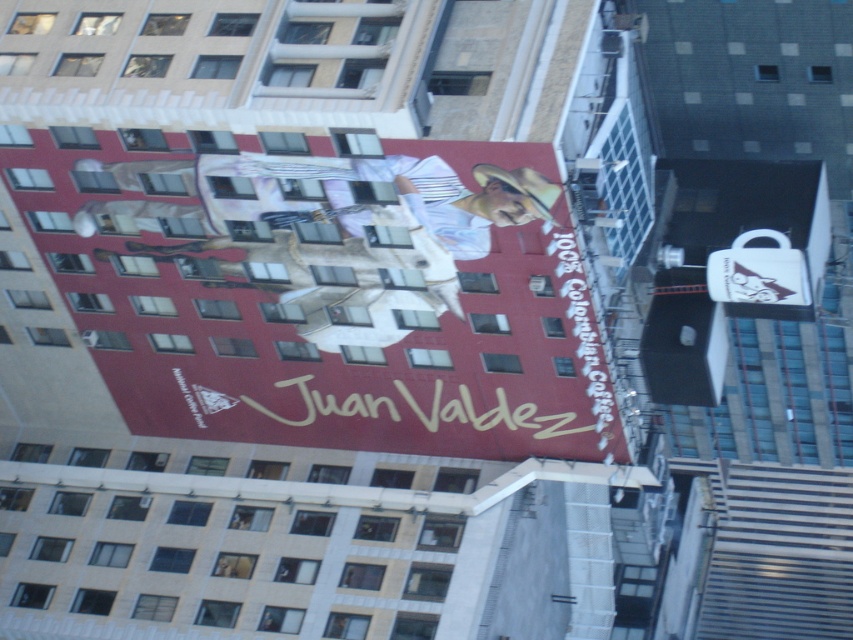
You are an advertiser checking the layout of a building facade. You need to place a new rectangular sign that must be wider than the existing white matte text at upper center. Can the space allocated for the matte red billboard at upper center accommodate this new sign?

The matte red billboard at upper center is wider than the white matte text at upper center. Therefore, the space allocated for the matte red billboard at upper center can accommodate the new sign as long as its width does not exceed the billboard.